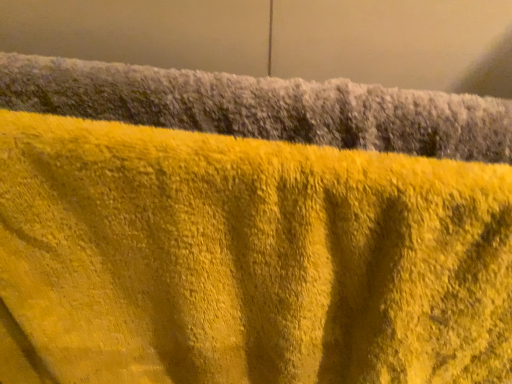
Question: From a real-world perspective, is yellow fuzzy towel at upper center, which ranks as the first towel in bottom-to-top order, positioned under yellow fuzzy towel at upper center, which is counted as the 1th towel, starting from the top, based on gravity?

Choices:
 (A) yes
 (B) no

Answer: (A)

Question: Is yellow fuzzy towel at upper center, the second towel when ordered from top to bottom, outside yellow fuzzy towel at upper center, the 2th towel in the bottom-to-top sequence?

Choices:
 (A) no
 (B) yes

Answer: (B)

Question: Considering the relative sizes of yellow fuzzy towel at upper center, the second towel when ordered from top to bottom, and yellow fuzzy towel at upper center, the 2th towel in the bottom-to-top sequence, in the image provided, is yellow fuzzy towel at upper center, the second towel when ordered from top to bottom, taller than yellow fuzzy towel at upper center, the 2th towel in the bottom-to-top sequence,?

Choices:
 (A) no
 (B) yes

Answer: (B)

Question: Is yellow fuzzy towel at upper center, which ranks as the first towel in bottom-to-top order, aimed at yellow fuzzy towel at upper center, the 2th towel in the bottom-to-top sequence?

Choices:
 (A) no
 (B) yes

Answer: (A)

Question: Is yellow fuzzy towel at upper center, which ranks as the first towel in bottom-to-top order, bigger than yellow fuzzy towel at upper center, the 2th towel in the bottom-to-top sequence?

Choices:
 (A) no
 (B) yes

Answer: (B)

Question: Is the position of yellow fuzzy towel at upper center, the second towel when ordered from top to bottom, more distant than that of yellow fuzzy towel at upper center, which is counted as the 1th towel, starting from the top?

Choices:
 (A) yes
 (B) no

Answer: (B)

Question: Can you confirm if yellow fuzzy towel at upper center, the 2th towel in the bottom-to-top sequence, is wider than yellow fuzzy towel at upper center, which ranks as the first towel in bottom-to-top order?

Choices:
 (A) yes
 (B) no

Answer: (B)

Question: Does yellow fuzzy towel at upper center, which is counted as the 1th towel, starting from the top, have a larger size compared to yellow fuzzy towel at upper center, which ranks as the first towel in bottom-to-top order?

Choices:
 (A) no
 (B) yes

Answer: (A)

Question: Is yellow fuzzy towel at upper center, which is counted as the 1th towel, starting from the top, thinner than yellow fuzzy towel at upper center, the second towel when ordered from top to bottom?

Choices:
 (A) yes
 (B) no

Answer: (A)

Question: From the image's perspective, is yellow fuzzy towel at upper center, which is counted as the 1th towel, starting from the top, under yellow fuzzy towel at upper center, the second towel when ordered from top to bottom?

Choices:
 (A) yes
 (B) no

Answer: (B)

Question: Is yellow fuzzy towel at upper center, the 2th towel in the bottom-to-top sequence, located outside yellow fuzzy towel at upper center, the second towel when ordered from top to bottom?

Choices:
 (A) no
 (B) yes

Answer: (B)

Question: Does yellow fuzzy towel at upper center, the 2th towel in the bottom-to-top sequence, have a smaller size compared to yellow fuzzy towel at upper center, which ranks as the first towel in bottom-to-top order?

Choices:
 (A) yes
 (B) no

Answer: (A)

Question: Do you think yellow fuzzy towel at upper center, the 2th towel in the bottom-to-top sequence, is within yellow fuzzy towel at upper center, the second towel when ordered from top to bottom, or outside of it?

Choices:
 (A) outside
 (B) inside

Answer: (A)